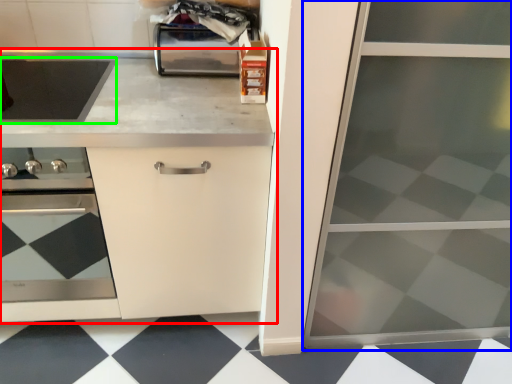
Question: Based on their relative distances, which object is farther from countertop (highlighted by a red box)? Choose from screen door (highlighted by a blue box) and kitchen appliance (highlighted by a green box).

Choices:
 (A) screen door
 (B) kitchen appliance

Answer: (A)